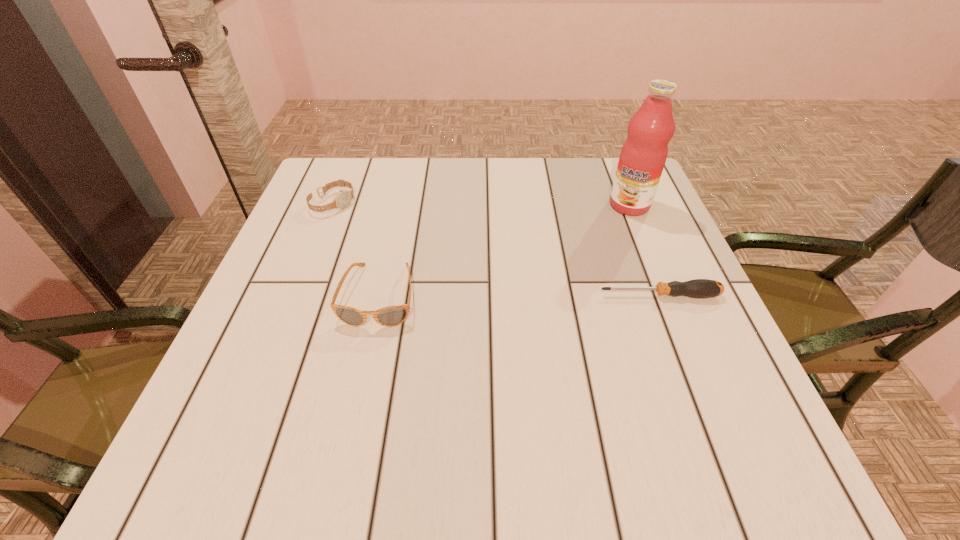
Image resolution: width=960 pixels, height=540 pixels. What are the coordinates of `vacant area that lies between the sunglasses and the leftmost object` in the screenshot? It's located at (356, 249).

Identify the location of free space between the watch and the tallest object. (481, 204).

I want to click on vacant space that is in between the shortest object and the tallest object, so click(644, 250).

Locate an element on the screen. Image resolution: width=960 pixels, height=540 pixels. free point between the screwdriver and the fruit juice is located at coordinates (644, 250).

Locate an element on the screen. object that stands as the closest to the leftmost object is located at coordinates (390, 316).

The image size is (960, 540). I want to click on object identified as the third closest to the shortest object, so click(343, 198).

The height and width of the screenshot is (540, 960). Identify the location of vacant space that satisfies the following two spatial constraints: 1. on the front side of the leftmost object; 2. at the tip of the screwdriver. (297, 295).